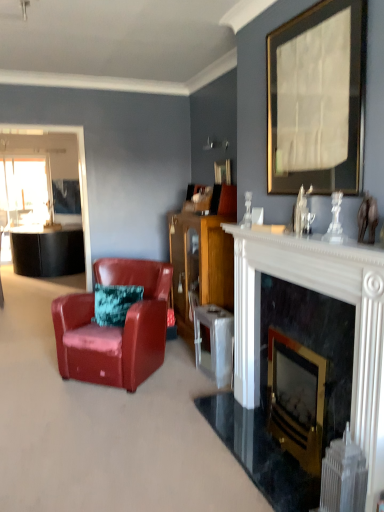
Question: Considering the relative positions of black marble fireplace at center, which ranks as the 1th fireplace in left-to-right order, and leather armchair at left in the image provided, is black marble fireplace at center, which ranks as the 1th fireplace in left-to-right order, to the left or to the right of leather armchair at left?

Choices:
 (A) right
 (B) left

Answer: (A)

Question: From the image's perspective, relative to leather armchair at left, is black marble fireplace at center, which ranks as the 1th fireplace in left-to-right order, above or below?

Choices:
 (A) above
 (B) below

Answer: (A)

Question: Which object is positioned farthest from the white plastic radiator at lower right?

Choices:
 (A) black marble fireplace at center, acting as the 1th fireplace starting from the right
 (B) metallic silver table at center
 (C) wooden cabinet at center
 (D) black marble fireplace at center, which ranks as the 1th fireplace in left-to-right order
 (E) leather armchair at left

Answer: (C)

Question: Which object is positioned closest to the leather armchair at left?

Choices:
 (A) metallic silver table at center
 (B) black marble fireplace at center, acting as the 1th fireplace starting from the right
 (C) white plastic radiator at lower right
 (D) wooden picture frame at upper center, positioned as the 1th picture frame in back-to-front order
 (E) gold-framed paper at upper center, which appears as the first picture frame when viewed from the right

Answer: (A)